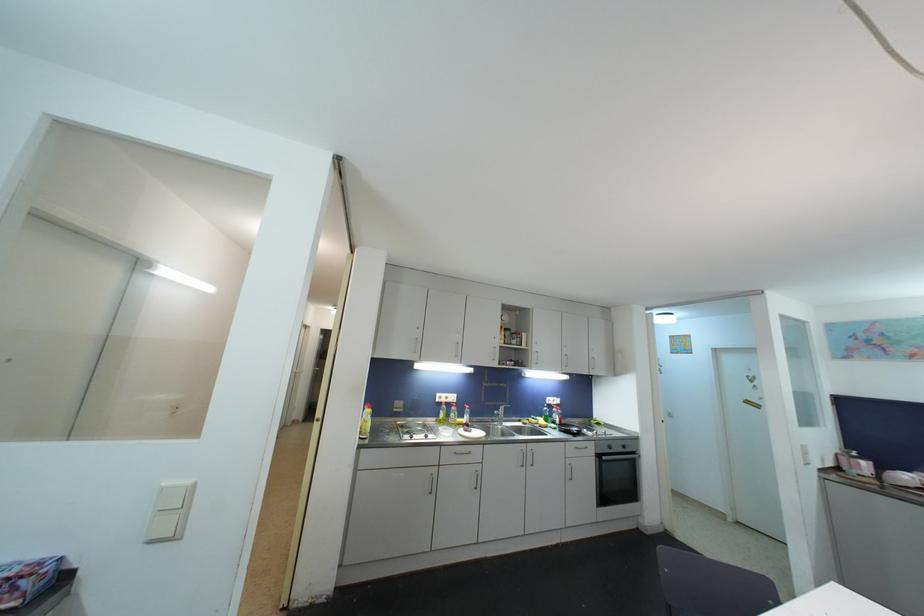
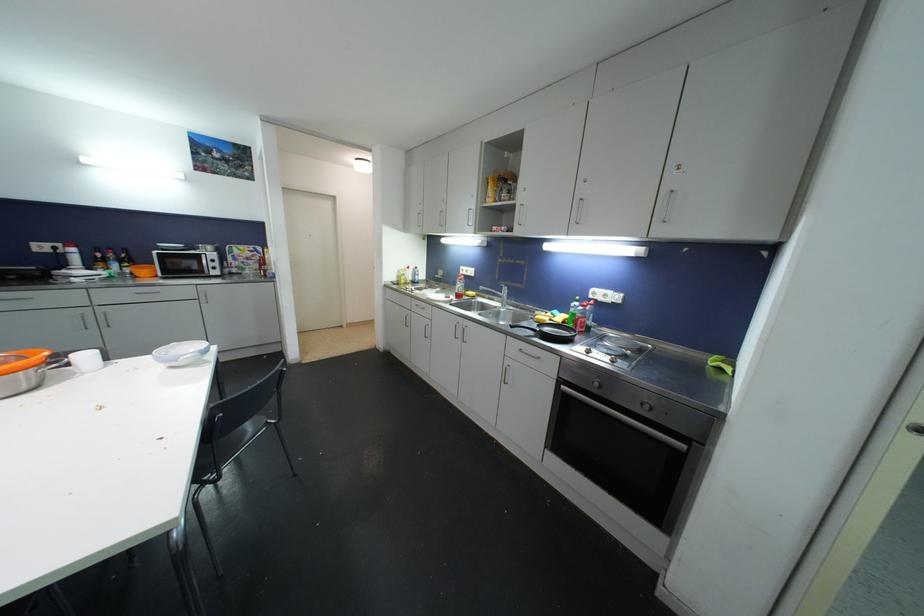
Locate, in the second image, the point that corresponds to [490,407] in the first image.

(504, 285)